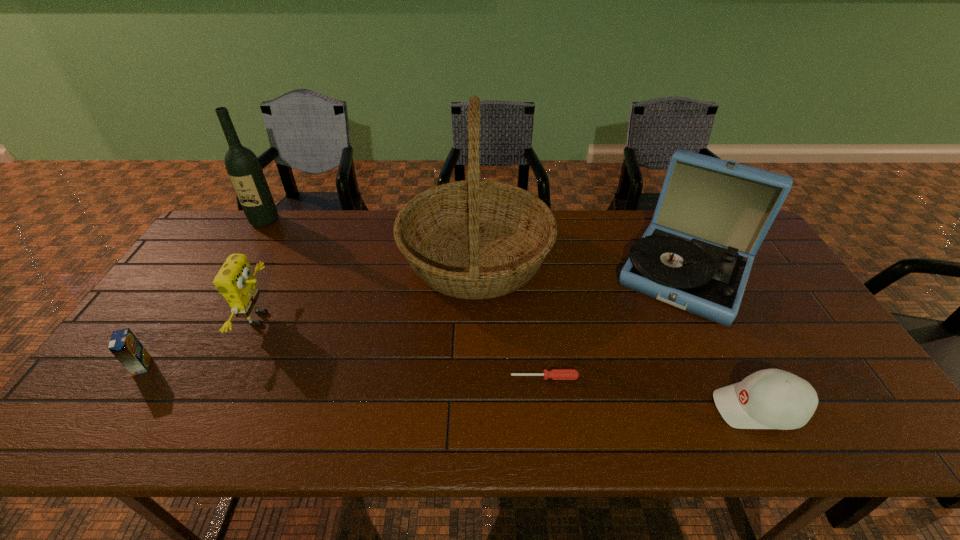
Identify the location of vacant region located 0.350m on the labeled side of the second object from left to right. (214, 304).

Locate an element on the screen. free space located 0.110m on the left of the phonograph record is located at coordinates (577, 272).

Locate an element on the screen. vacant space located 0.350m on the face of the fourth shortest object is located at coordinates (402, 319).

You are a GUI agent. You are given a task and a screenshot of the screen. Output one action in this format:
    pyautogui.click(x=<x>, y=<y>)
    Task: Click on the vacant area situated on the right of the leftmost object
    Image resolution: width=960 pixels, height=540 pixels.
    Given the screenshot: What is the action you would take?
    pyautogui.click(x=240, y=366)

Identify the location of vacant space located 0.380m on the front-facing side of the nearest object. (548, 408).

Locate an element on the screen. The height and width of the screenshot is (540, 960). free location located on the front-facing side of the nearest object is located at coordinates (639, 408).

In order to click on free space located 0.370m on the front-facing side of the nearest object in this screenshot , I will do `click(552, 408)`.

Where is `vacant space located on the right of the screwdriver`? This screenshot has width=960, height=540. vacant space located on the right of the screwdriver is located at coordinates [612, 377].

The height and width of the screenshot is (540, 960). What are the coordinates of `basket present at the far edge` in the screenshot? It's located at (474, 239).

You are a GUI agent. You are given a task and a screenshot of the screen. Output one action in this format:
    pyautogui.click(x=<x>, y=<y>)
    Task: Click on the wine bottle that is positioned at the far edge
    Image resolution: width=960 pixels, height=540 pixels.
    Given the screenshot: What is the action you would take?
    pyautogui.click(x=243, y=167)